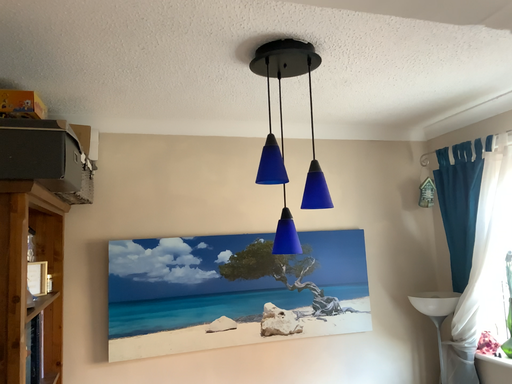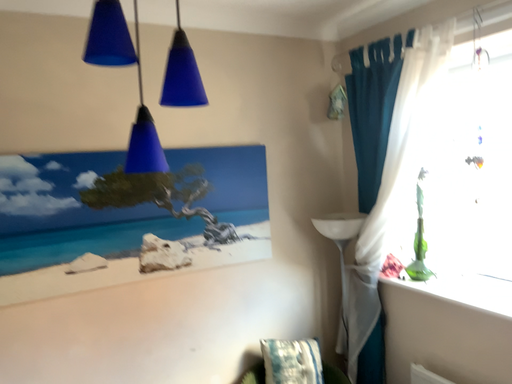
Question: Which way did the camera rotate in the video?

Choices:
 (A) rotated right
 (B) rotated left

Answer: (A)